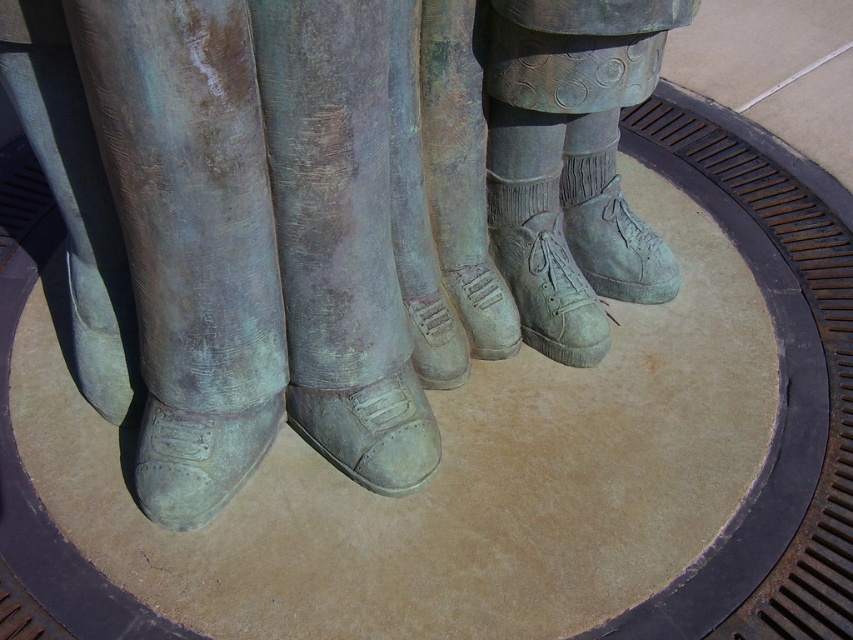
Question: Estimate the real-world distances between objects in this image. Which object is farther from the green patina boot at center?

Choices:
 (A) bronze shoes at center
 (B) matte green boot at center
 (C) green suede boot at center

Answer: (C)

Question: Can you confirm if green patina boot at center is positioned below green suede boot at center?

Choices:
 (A) no
 (B) yes

Answer: (B)

Question: Is bronze shoes at center smaller than green suede boot at center?

Choices:
 (A) yes
 (B) no

Answer: (B)

Question: Which point is closer to the camera taking this photo?

Choices:
 (A) (589, 330)
 (B) (363, 390)
 (C) (437, 232)
 (D) (576, 257)

Answer: (B)

Question: Which of these objects is positioned closest to the matte green boot at center?

Choices:
 (A) bronze shoes at center
 (B) green patina boot at center

Answer: (A)

Question: Where is green patina boot at center located in relation to green suede boot at center in the image?

Choices:
 (A) above
 (B) below

Answer: (B)